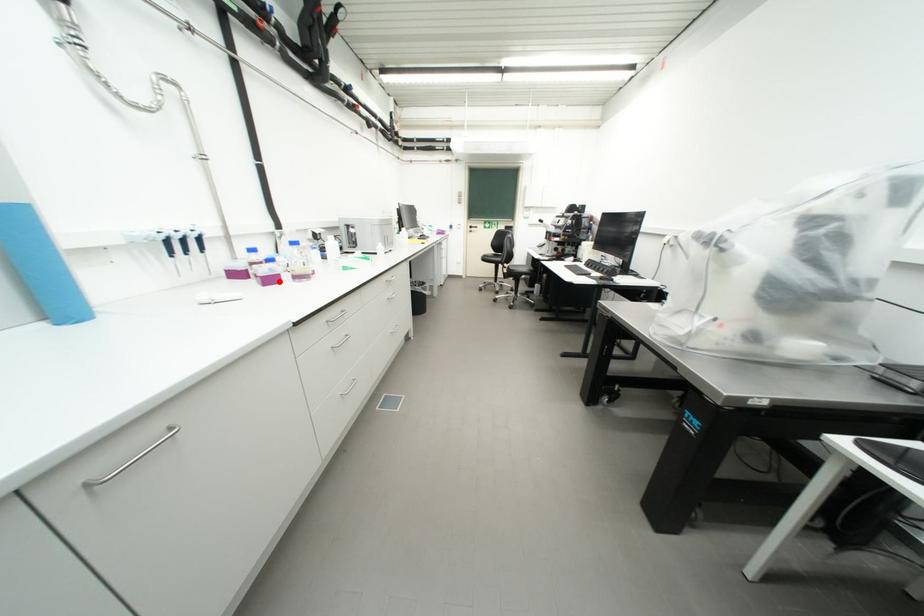
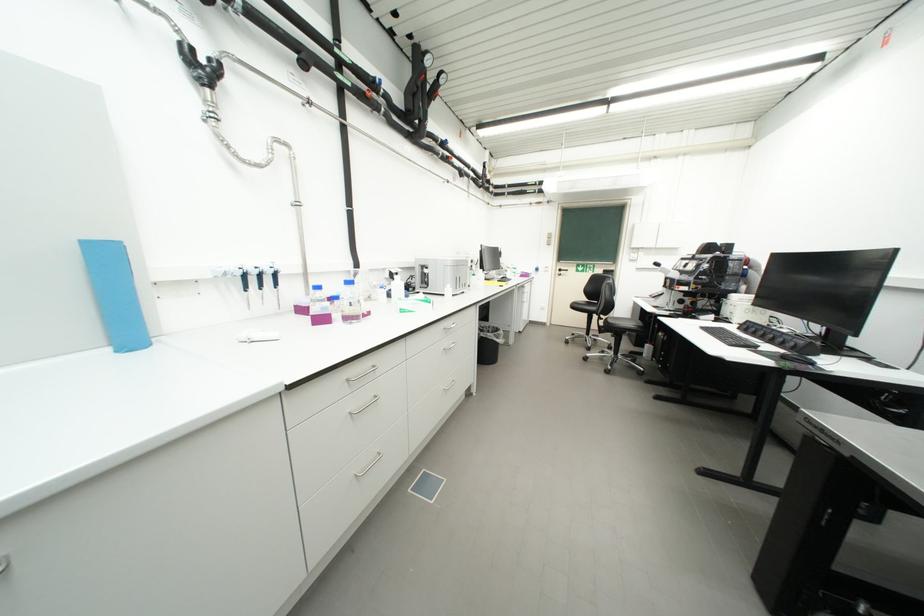
In the second image, find the point that corresponds to the highlighted location in the first image.

(330, 321)